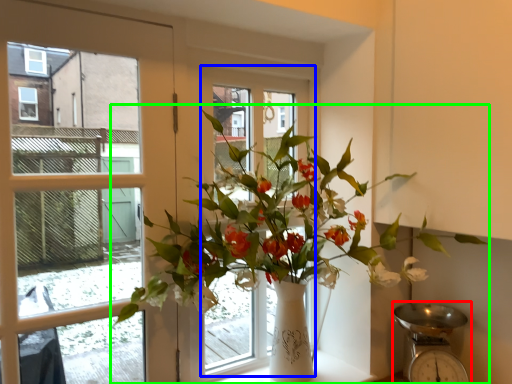
Question: Based on their relative distances, which object is farther from scale (highlighted by a red box)? Choose from window frame (highlighted by a blue box) and houseplant (highlighted by a green box).

Choices:
 (A) window frame
 (B) houseplant

Answer: (A)